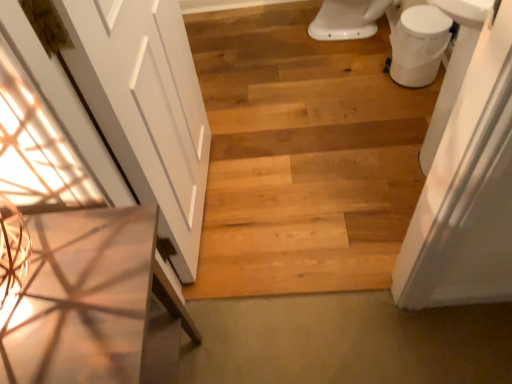
Locate an element on the screen. Image resolution: width=512 pixels, height=384 pixels. free area in between white matte door at left and natural wood plank at center is located at coordinates (274, 232).